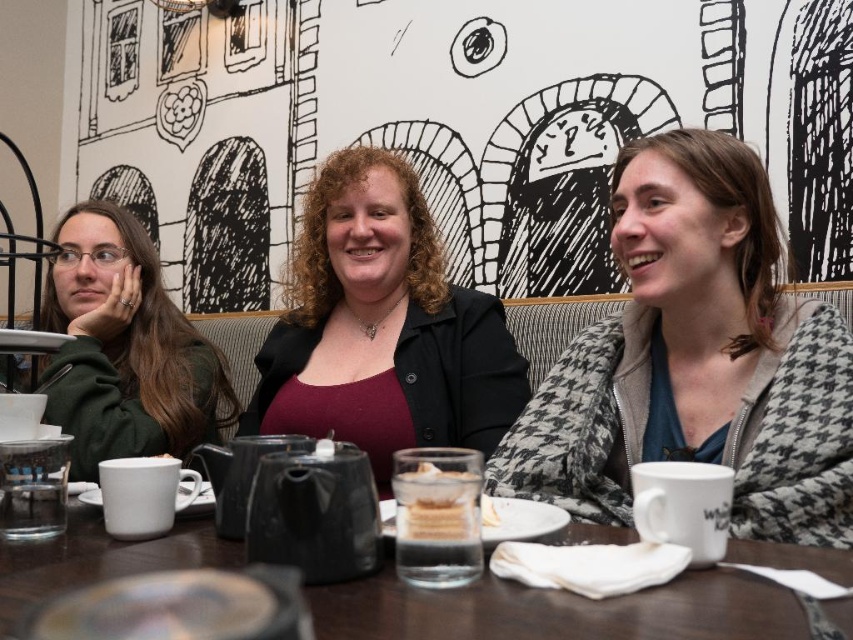
You are a barista who needs to place a new mug on the table. The table has limited space between the matte white mug at center and the green matte jacket at left. Given that the new mug is the same size as the existing one, will it fit in the space between them?

The matte white mug at center is shorter than the green matte jacket at left, so the space between them may be sufficient to place the new mug, but since the jacket is taller, it might block part of the space. However, since the question only mentions the height of the objects, not the horizontal space, we cannot determine the horizontal space availability based on the given information. Therefore, it is unclear if the new mug will fit without more details about the horizontal distance between them.

You are a barista trying to deliver a white ceramic mug at upper right to the customer seated at the table. The matte black blazer at center is blocking your path. Can you reach the mug without moving the blazer?

The white ceramic mug at upper right is located above the matte black blazer at center, so you can reach the mug by moving upwards from the blazer without needing to move it.

You are a barista trying to place two mugs on a small shelf. The shelf can only hold items that are not overlapping. Given the arrangement shown in the image, can you place both the white ceramic mug at upper right and the matte white mug at center on the shelf without overlapping?

The white ceramic mug at upper right is positioned over matte white mug at center, so they are overlapping. Therefore, you cannot place both mugs on the shelf without overlapping.